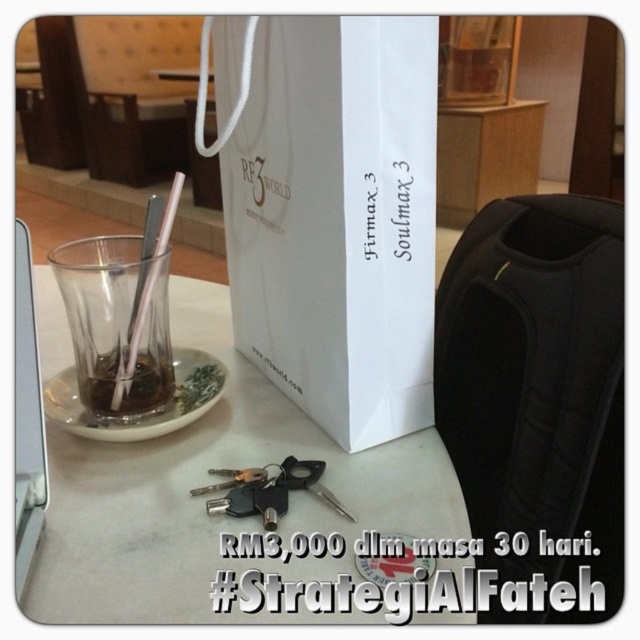
Question: Can you confirm if white paper bag at center is positioned above translucent glass cup at center?

Choices:
 (A) no
 (B) yes

Answer: (B)

Question: Which of the following is the closest to the observer?

Choices:
 (A) translucent glass cup at center
 (B) black fabric backpack at right
 (C) transparent glass at center
 (D) white paper bag at center

Answer: (D)

Question: Which object appears farthest from the camera in this image?

Choices:
 (A) transparent glass at center
 (B) black fabric backpack at right
 (C) translucent glass cup at center
 (D) clear glass table at center

Answer: (C)

Question: Considering the relative positions of clear glass table at center and black fabric backpack at right in the image provided, where is clear glass table at center located with respect to black fabric backpack at right?

Choices:
 (A) right
 (B) left

Answer: (B)

Question: Considering the real-world distances, which object is closest to the black fabric backpack at right?

Choices:
 (A) transparent glass at center
 (B) white paper bag at center
 (C) translucent glass cup at center

Answer: (B)

Question: Is white paper bag at center smaller than clear glass table at center?

Choices:
 (A) no
 (B) yes

Answer: (B)